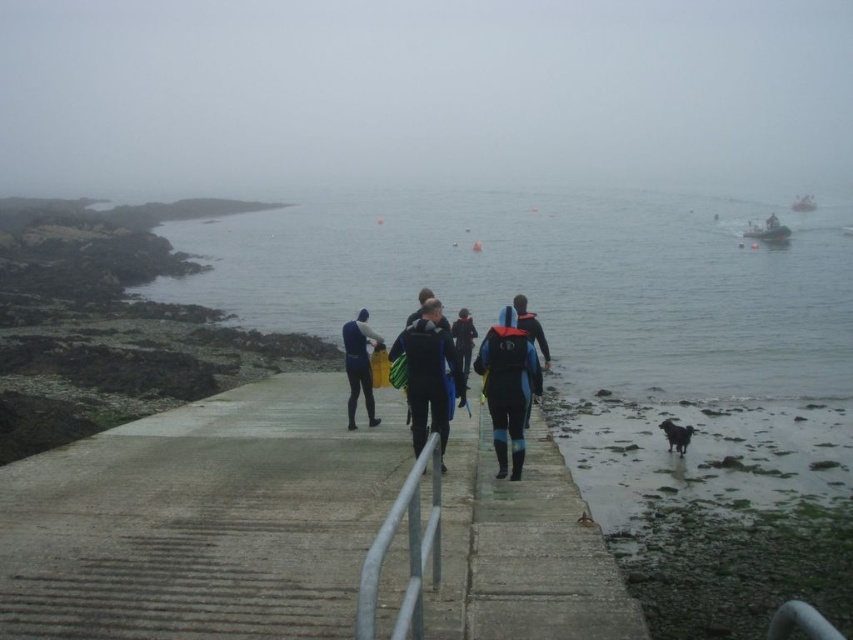
Who is positioned more to the right, concrete at center or black wetsuit at center?

black wetsuit at center

Does concrete at center have a lesser height compared to black wetsuit at center?

Correct, concrete at center is not as tall as black wetsuit at center.

Is point (442, 588) farther from camera compared to point (469, 355)?

No.

The height and width of the screenshot is (640, 853). I want to click on concrete at center, so click(x=200, y=520).

Measure the distance from clear water at center to blue matte wetsuit at center.

clear water at center and blue matte wetsuit at center are 26.59 meters apart.

Find the location of a particular element. clear water at center is located at coordinates 555,280.

Identify the location of clear water at center. The image size is (853, 640). (555, 280).

Is blue wetsuit at center taller than black wetsuit at center?

Indeed, blue wetsuit at center has a greater height compared to black wetsuit at center.

Does blue wetsuit at center come in front of black wetsuit at center?

Yes, blue wetsuit at center is closer to the viewer.

Does point (428, 320) come closer to viewer compared to point (466, 369)?

Yes, it is.

This screenshot has width=853, height=640. In order to click on blue wetsuit at center in this screenshot , I will do `click(428, 376)`.